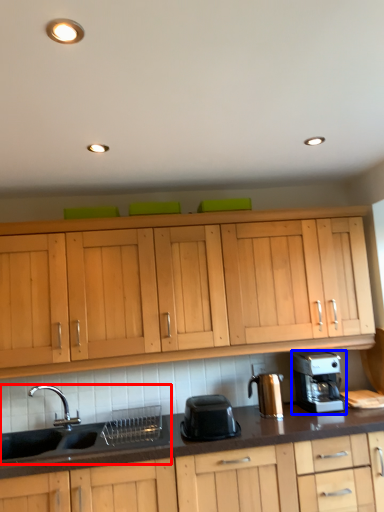
Question: Which of the following is the farthest to the observer, sink (highlighted by a red box) or home appliance (highlighted by a blue box)?

Choices:
 (A) sink
 (B) home appliance

Answer: (B)